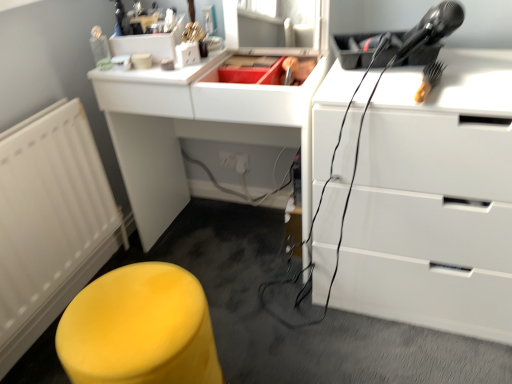
Identify the location of white glossy chest of drawers at upper right. This screenshot has height=384, width=512. (435, 201).

What do you see at coordinates (194, 129) in the screenshot? I see `white glossy computer desk at center` at bounding box center [194, 129].

This screenshot has height=384, width=512. I want to click on yellow plastic brush at upper right, so click(x=429, y=80).

How many degrees apart are the facing directions of matte yellow stool at lower left and white matte radiator at left?

1.83 degrees separate the facing orientations of matte yellow stool at lower left and white matte radiator at left.

From a real-world perspective, which is physically above, matte yellow stool at lower left or white matte radiator at left?

white matte radiator at left, from a real-world perspective.

From their relative heights in the image, would you say matte yellow stool at lower left is taller or shorter than white matte radiator at left?

matte yellow stool at lower left is shorter than white matte radiator at left.

Is matte yellow stool at lower left touching white matte radiator at left?

matte yellow stool at lower left and white matte radiator at left are not in contact.

Can white glossy chest of drawers at upper right be found inside matte yellow stool at lower left?

That's incorrect, white glossy chest of drawers at upper right is not inside matte yellow stool at lower left.

Is matte yellow stool at lower left next to white glossy chest of drawers at upper right?

No, matte yellow stool at lower left is not touching white glossy chest of drawers at upper right.

Find the location of `furniture located on the left of white glossy chest of drawers at upper right`. furniture located on the left of white glossy chest of drawers at upper right is located at coordinates (139, 329).

Which object is closer to the camera, matte yellow stool at lower left or white glossy chest of drawers at upper right?

Positioned in front is matte yellow stool at lower left.

Consider the image. Can you confirm if white glossy chest of drawers at upper right is positioned to the right of yellow plastic brush at upper right?

Correct, you'll find white glossy chest of drawers at upper right to the right of yellow plastic brush at upper right.

Is white glossy chest of drawers at upper right looking in the opposite direction of yellow plastic brush at upper right?

white glossy chest of drawers at upper right does not have its back to yellow plastic brush at upper right.

Image resolution: width=512 pixels, height=384 pixels. What are the coordinates of `tool above the white glossy chest of drawers at upper right (from a real-world perspective)` in the screenshot? It's located at (429, 80).

How distant is white glossy chest of drawers at upper right from yellow plastic brush at upper right?

white glossy chest of drawers at upper right and yellow plastic brush at upper right are 13.74 inches apart.

Can you confirm if yellow plastic brush at upper right is shorter than white glossy computer desk at center?

Yes.

Are yellow plastic brush at upper right and white glossy computer desk at center far apart?

Actually, yellow plastic brush at upper right and white glossy computer desk at center are a little close together.

Which point is more forward, (429, 81) or (238, 94)?

The point (429, 81) is in front.

Can you tell me how much yellow plastic brush at upper right and white glossy computer desk at center differ in facing direction?

11.6 degrees.

Is point (82, 189) farther from viewer compared to point (426, 71)?

Yes, point (82, 189) is behind point (426, 71).

In the scene shown: Between white matte radiator at left and yellow plastic brush at upper right, which one has more height?

white matte radiator at left.

Is white matte radiator at left not inside yellow plastic brush at upper right?

Indeed, white matte radiator at left is completely outside yellow plastic brush at upper right.

From the picture: Considering the positions of objects white matte radiator at left and yellow plastic brush at upper right in the image provided, who is more to the left, white matte radiator at left or yellow plastic brush at upper right?

white matte radiator at left is more to the left.

How different are the orientations of white glossy computer desk at center and white matte radiator at left in degrees?

91.1 degrees separate the facing orientations of white glossy computer desk at center and white matte radiator at left.

From the image's perspective, who appears lower, white glossy computer desk at center or white matte radiator at left?

white matte radiator at left, from the image's perspective.

Considering the positions of points (234, 124) and (37, 245), is point (234, 124) closer to camera compared to point (37, 245)?

No, it is not.

Identify the location of radiator in front of the white glossy computer desk at center. (50, 222).

Where is `computer desk above the matte yellow stool at lower left (from the image's perspective)`? The image size is (512, 384). computer desk above the matte yellow stool at lower left (from the image's perspective) is located at coordinates (194, 129).

Does white glossy computer desk at center have a lesser width compared to matte yellow stool at lower left?

In fact, white glossy computer desk at center might be wider than matte yellow stool at lower left.

Considering the points (249, 135) and (172, 289), which point is behind, point (249, 135) or point (172, 289)?

The point (249, 135) is more distant.

Based on their sizes in the image, would you say white glossy computer desk at center is bigger or smaller than matte yellow stool at lower left?

Considering their sizes, white glossy computer desk at center takes up more space than matte yellow stool at lower left.

You are a GUI agent. You are given a task and a screenshot of the screen. Output one action in this format:
    pyautogui.click(x=<x>, y=<y>)
    Task: Click on the radiator above the matte yellow stool at lower left (from the image's perspective)
    The height and width of the screenshot is (384, 512).
    Given the screenshot: What is the action you would take?
    pyautogui.click(x=50, y=222)

Identify the location of furniture below the white glossy chest of drawers at upper right (from a real-world perspective). The image size is (512, 384). (139, 329).

From the picture: From the image, which object appears to be farther from white glossy computer desk at center, white glossy chest of drawers at upper right or white matte radiator at left?

white glossy chest of drawers at upper right is positioned further to the anchor white glossy computer desk at center.

Looking at the image, which one is located further to matte yellow stool at lower left, white glossy chest of drawers at upper right or yellow plastic brush at upper right?

Based on the image, yellow plastic brush at upper right appears to be further to matte yellow stool at lower left.

Estimate the real-world distances between objects in this image. Which object is closer to white glossy chest of drawers at upper right, white matte radiator at left or matte yellow stool at lower left?

Based on the image, matte yellow stool at lower left appears to be nearer to white glossy chest of drawers at upper right.

Looking at the image, which one is located further to yellow plastic brush at upper right, white glossy computer desk at center or white matte radiator at left?

The object further to yellow plastic brush at upper right is white matte radiator at left.

Which object lies nearer to the anchor point matte yellow stool at lower left, yellow plastic brush at upper right or white glossy chest of drawers at upper right?

white glossy chest of drawers at upper right.

Considering their positions, is matte yellow stool at lower left positioned further to yellow plastic brush at upper right than white glossy chest of drawers at upper right?

Based on the image, matte yellow stool at lower left appears to be further to yellow plastic brush at upper right.

Considering their positions, is white glossy computer desk at center positioned closer to matte yellow stool at lower left than white matte radiator at left?

Among the two, white matte radiator at left is located nearer to matte yellow stool at lower left.

Estimate the real-world distances between objects in this image. Which object is further from white matte radiator at left, yellow plastic brush at upper right or white glossy chest of drawers at upper right?

yellow plastic brush at upper right is positioned further to the anchor white matte radiator at left.

Locate an element on the screen. computer desk between white matte radiator at left and yellow plastic brush at upper right is located at coordinates (194, 129).

The width and height of the screenshot is (512, 384). I want to click on furniture between white matte radiator at left and yellow plastic brush at upper right in the horizontal direction, so click(x=139, y=329).

At what (x,y) coordinates should I click in order to perform the action: click on computer desk between yellow plastic brush at upper right and matte yellow stool at lower left vertically. Please return your answer as a coordinate pair (x, y). Looking at the image, I should click on (194, 129).

Locate an element on the screen. tool between matte yellow stool at lower left and white glossy chest of drawers at upper right is located at coordinates (429, 80).